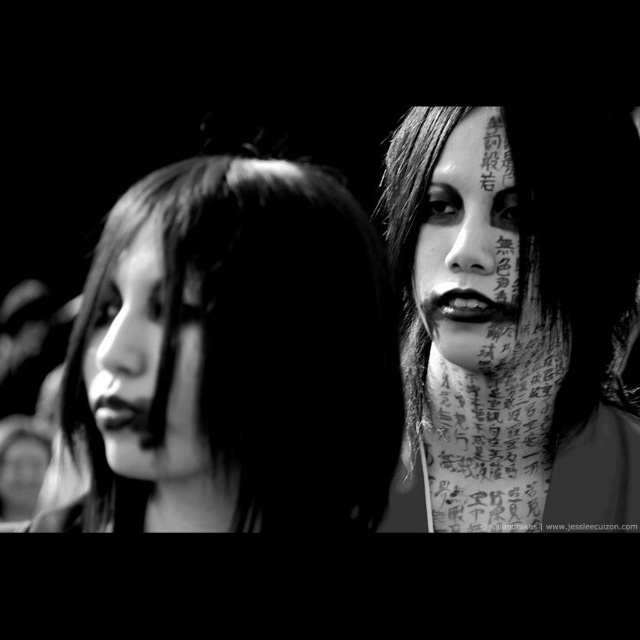
In the black and white photograph, there are two individuals with long dark hair. The individual on the right has text written on their neck and face, while the one on the left is slightly out of focus. A point at coordinates (x=234, y=356) is marked. Which individual is closer to this point?

The point at (x=234, y=356) marks the smooth skin face at center, so the individual with the smooth skin face at center is closer to the point.

You are a photographer standing 30 inches away from the camera. You want to take a clear photo of the smooth skin face at center. Can you adjust your position to ensure you are exactly at the optimal distance for the camera to focus on the face?

The smooth skin face at center and camera are 29.89 inches apart. Since you are standing 30 inches away from the camera, you need to move 0.11 inches closer to the camera to match the exact distance between the face and the camera for optimal focus.